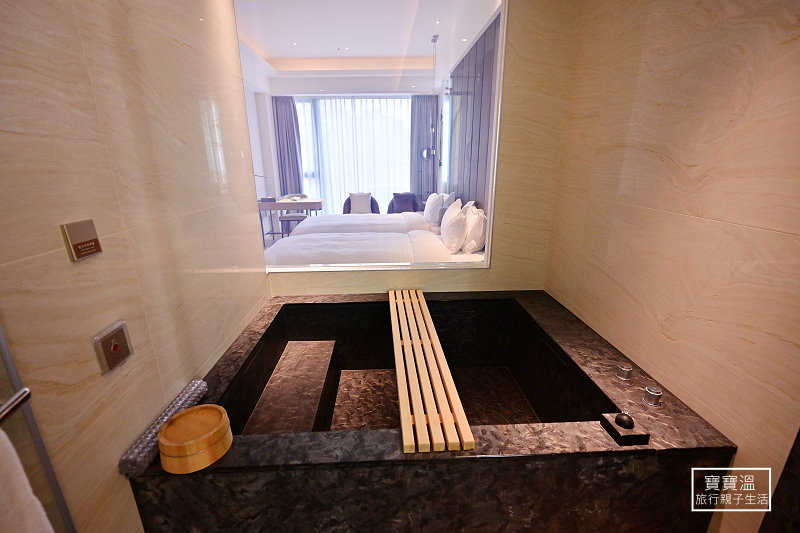
Identify the location of white comforter blankets. The height and width of the screenshot is (533, 800). (390, 246), (374, 220).